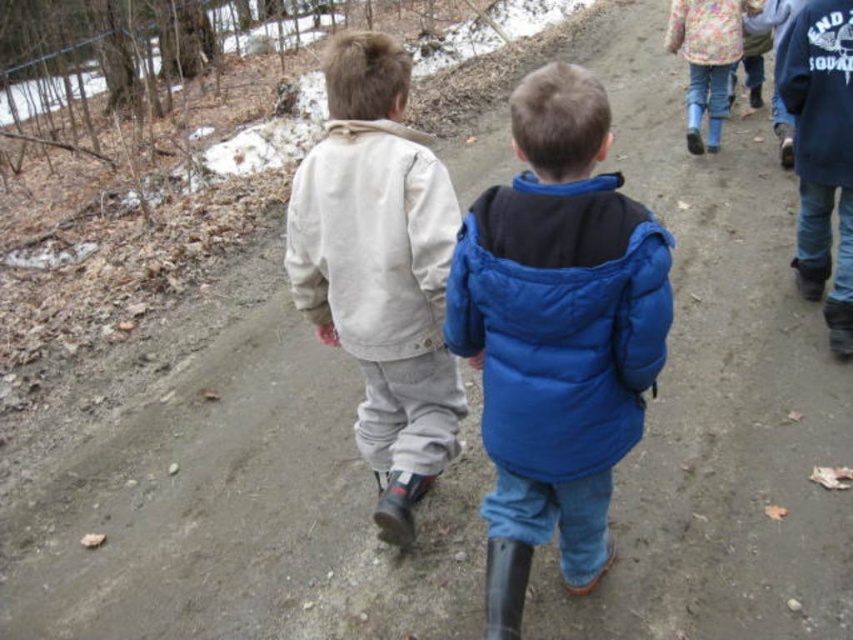
Question: Which object is positioned closest to the light beige fleece jacket at center?

Choices:
 (A) light beige cotton jacket at center
 (B) blue puffy jacket at center

Answer: (A)

Question: Based on their relative distances, which object is nearer to the light beige fleece jacket at center?

Choices:
 (A) light beige cotton jacket at center
 (B) blue puffy jacket at center

Answer: (A)

Question: Observing the image, what is the correct spatial positioning of light beige fleece jacket at center in reference to blue puffy jacket at center?

Choices:
 (A) right
 (B) left

Answer: (B)

Question: Is blue puffy jacket at center positioned behind light beige cotton jacket at center?

Choices:
 (A) yes
 (B) no

Answer: (B)

Question: Which of these objects is positioned closest to the light beige fleece jacket at center?

Choices:
 (A) blue puffy jacket at center
 (B) light beige cotton jacket at center

Answer: (B)

Question: Can you confirm if light beige fleece jacket at center is positioned above blue puffy jacket at center?

Choices:
 (A) no
 (B) yes

Answer: (B)